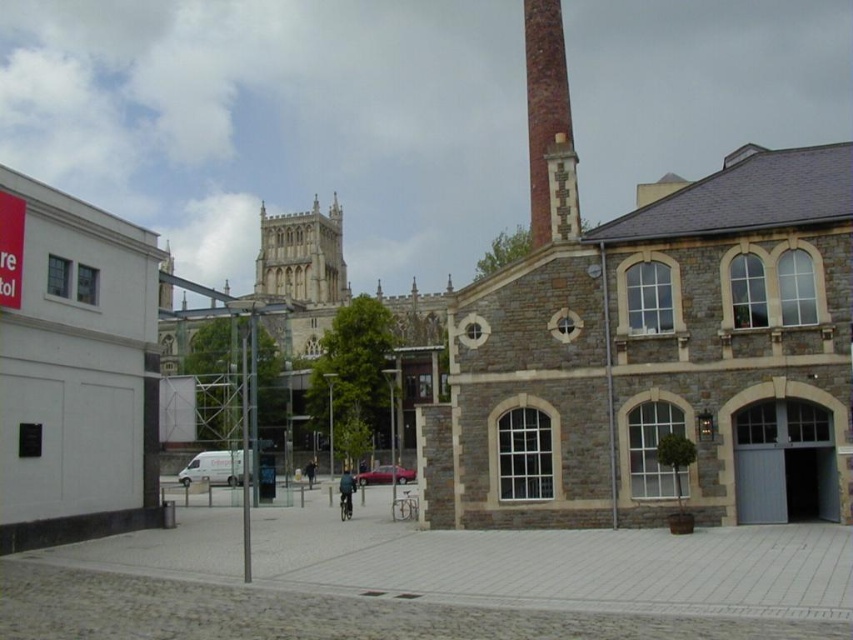
You are an architect analyzing the urban scene. You notice the stone gothic tower at center and the brick chimney at upper right. Which of these two structures is positioned farther away from the viewer?

The brick chimney at upper right is behind the stone gothic tower at center, so it is farther away from the viewer.

You are an architect evaluating the urban scene. You need to determine which structure reaches higher into the sky between the stone gothic tower at center and the brick chimney at upper right. Based on the image, which one is taller?

The stone gothic tower at center is taller than the brick chimney at upper right according to the description.